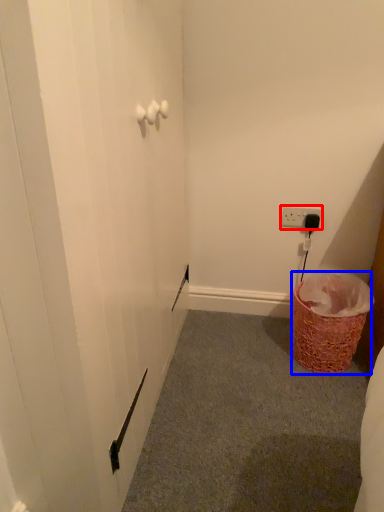
Question: Which object appears closest to the camera in this image, electric outlet (highlighted by a red box) or basket (highlighted by a blue box)?

Choices:
 (A) electric outlet
 (B) basket

Answer: (B)